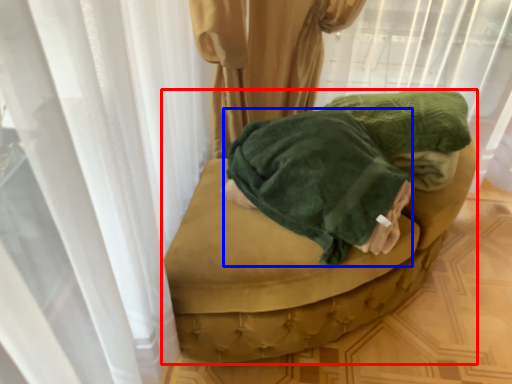
Question: Which object is further to the camera taking this photo, furniture (highlighted by a red box) or clothing (highlighted by a blue box)?

Choices:
 (A) furniture
 (B) clothing

Answer: (A)